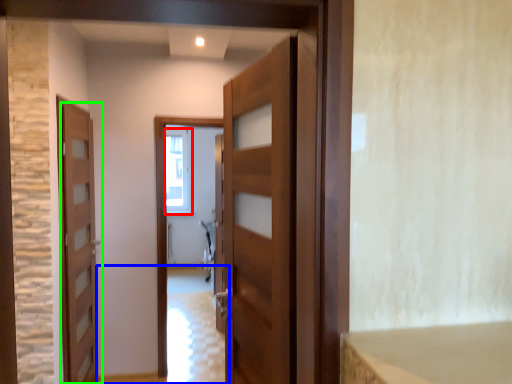
Question: Which object is positioned closest to window (highlighted by a red box)? Select from path (highlighted by a blue box) and door (highlighted by a green box).

Choices:
 (A) path
 (B) door

Answer: (A)